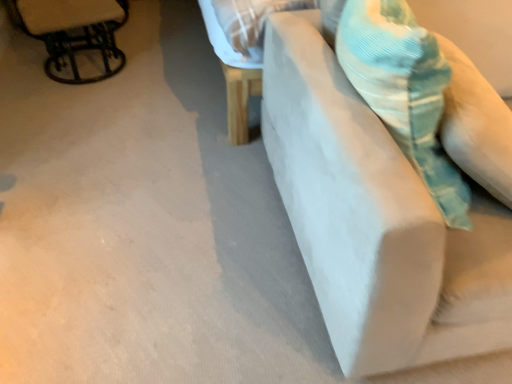
In order to click on metallic black chair at upper left in this screenshot , I will do `click(75, 36)`.

In order to face white fabric couch at right, should I rotate leftwards or rightwards?

To face it directly, rotate right by 28.460 degrees.

In order to click on metallic black chair at upper left in this screenshot , I will do `click(75, 36)`.

Is metallic black chair at upper left oriented towards white fabric couch at right?

No, metallic black chair at upper left is not oriented towards white fabric couch at right.

How different are the orientations of metallic black chair at upper left and white fabric couch at right in degrees?

17.4 degrees.

Are metallic black chair at upper left and white fabric couch at right making contact?

No, metallic black chair at upper left is not with white fabric couch at right.

Who is shorter, metallic black chair at upper left or white fabric couch at right?

Standing shorter between the two is metallic black chair at upper left.

Could you tell me if white fabric couch at right is turned towards metallic black chair at upper left?

No.

What's the angular difference between white fabric couch at right and metallic black chair at upper left's facing directions?

white fabric couch at right and metallic black chair at upper left are facing 17.4 degrees away from each other.

Does white fabric couch at right have a lesser height compared to metallic black chair at upper left?

No, white fabric couch at right is not shorter than metallic black chair at upper left.

Is white fabric couch at right located outside metallic black chair at upper left?

That's correct, white fabric couch at right is outside of metallic black chair at upper left.

Are white fabric couch at right and corduroy teal throw pillow at upper right making contact?

white fabric couch at right is not next to corduroy teal throw pillow at upper right, and they're not touching.

This screenshot has width=512, height=384. Identify the location of furniture that is under the corduroy teal throw pillow at upper right (from a real-world perspective). (375, 220).

Can you confirm if white fabric couch at right is wider than corduroy teal throw pillow at upper right?

Correct, the width of white fabric couch at right exceeds that of corduroy teal throw pillow at upper right.

From a real-world perspective, which is physically above, corduroy teal throw pillow at upper right or white fabric couch at right?

In real-world perspective, corduroy teal throw pillow at upper right is above.

From the image's perspective, which is above, corduroy teal throw pillow at upper right or white fabric couch at right?

corduroy teal throw pillow at upper right is shown above in the image.

Locate an element on the screen. throw pillow to the left of white fabric couch at right is located at coordinates (404, 91).

In the image, is corduroy teal throw pillow at upper right on the left side or the right side of white fabric couch at right?

Based on their positions, corduroy teal throw pillow at upper right is located to the left of white fabric couch at right.

Image resolution: width=512 pixels, height=384 pixels. I want to click on chair behind the corduroy teal throw pillow at upper right, so click(75, 36).

Is metallic black chair at upper left inside or outside of corduroy teal throw pillow at upper right?

metallic black chair at upper left lies outside corduroy teal throw pillow at upper right.

How many degrees apart are the facing directions of metallic black chair at upper left and corduroy teal throw pillow at upper right?

60.7 degrees.

Does metallic black chair at upper left appear on the right side of corduroy teal throw pillow at upper right?

Incorrect, metallic black chair at upper left is not on the right side of corduroy teal throw pillow at upper right.

Locate an element on the screen. This screenshot has height=384, width=512. chair below the corduroy teal throw pillow at upper right (from a real-world perspective) is located at coordinates (75, 36).

From a real-world perspective, between corduroy teal throw pillow at upper right and metallic black chair at upper left, who is vertically lower?

metallic black chair at upper left, from a real-world perspective.

In terms of height, does corduroy teal throw pillow at upper right look taller or shorter compared to metallic black chair at upper left?

In the image, corduroy teal throw pillow at upper right appears to be taller than metallic black chair at upper left.

Is corduroy teal throw pillow at upper right touching metallic black chair at upper left?

No, corduroy teal throw pillow at upper right is not in contact with metallic black chair at upper left.

This screenshot has height=384, width=512. I want to click on chair above the white fabric couch at right (from the image's perspective), so click(x=75, y=36).

This screenshot has height=384, width=512. Find the location of `furniture located on the right of metallic black chair at upper left`. furniture located on the right of metallic black chair at upper left is located at coordinates (375, 220).

In the scene shown: Considering their positions, is corduroy teal throw pillow at upper right positioned further to metallic black chair at upper left than white fabric couch at right?

corduroy teal throw pillow at upper right is further to metallic black chair at upper left.

Which object lies nearer to the anchor point white fabric couch at right, corduroy teal throw pillow at upper right or metallic black chair at upper left?

corduroy teal throw pillow at upper right is positioned closer to the anchor white fabric couch at right.

Looking at the image, which one is located closer to metallic black chair at upper left, white fabric couch at right or corduroy teal throw pillow at upper right?

Based on the image, white fabric couch at right appears to be nearer to metallic black chair at upper left.

When comparing their distances from white fabric couch at right, does metallic black chair at upper left or corduroy teal throw pillow at upper right seem closer?

Among the two, corduroy teal throw pillow at upper right is located nearer to white fabric couch at right.

Consider the image. Based on their spatial positions, is white fabric couch at right or metallic black chair at upper left closer to corduroy teal throw pillow at upper right?

Based on the image, white fabric couch at right appears to be nearer to corduroy teal throw pillow at upper right.

From the image, which object appears to be farther from corduroy teal throw pillow at upper right, metallic black chair at upper left or white fabric couch at right?

The object further to corduroy teal throw pillow at upper right is metallic black chair at upper left.

I want to click on throw pillow located between metallic black chair at upper left and white fabric couch at right in the left-right direction, so click(404, 91).